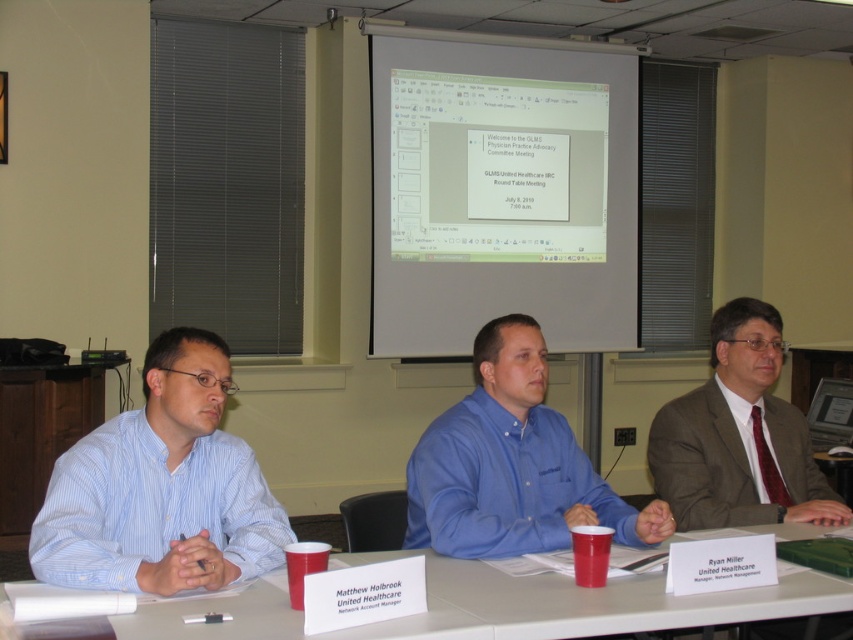
Between blue striped shirt at left and matte brown suit at right, which one has more height?

With more height is matte brown suit at right.

Which is in front, point (196, 490) or point (718, 422)?

Positioned in front is point (196, 490).

Identify the location of blue striped shirt at left. (161, 486).

Where is `blue striped shirt at left`? This screenshot has height=640, width=853. blue striped shirt at left is located at coordinates (161, 486).

What do you see at coordinates (511, 465) in the screenshot? This screenshot has width=853, height=640. I see `blue button-down shirt at center` at bounding box center [511, 465].

How much distance is there between blue button-down shirt at center and matte brown suit at right?

The distance of blue button-down shirt at center from matte brown suit at right is 58.33 centimeters.

Between point (410, 461) and point (724, 464), which one is positioned in front?

Positioned in front is point (410, 461).

You are a GUI agent. You are given a task and a screenshot of the screen. Output one action in this format:
    pyautogui.click(x=<x>, y=<y>)
    Task: Click on the blue button-down shirt at center
    The image size is (853, 640).
    Given the screenshot: What is the action you would take?
    pyautogui.click(x=511, y=465)

Between white matte projector screen at upper center and matte brown suit at right, which one is positioned lower?

matte brown suit at right is below.

Which is more to the right, white matte projector screen at upper center or matte brown suit at right?

Positioned to the right is matte brown suit at right.

Who is more forward, (405, 112) or (769, 512)?

Positioned in front is point (769, 512).

At what (x,y) coordinates should I click in order to perform the action: click on white matte projector screen at upper center. Please return your answer as a coordinate pair (x, y). The height and width of the screenshot is (640, 853). Looking at the image, I should click on (502, 189).